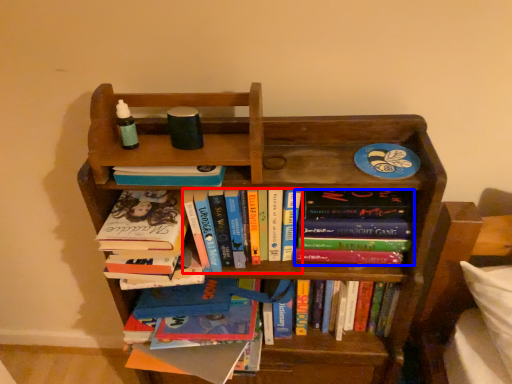
Question: Which point is closer to the camera, book (highlighted by a red box) or book (highlighted by a blue box)?

Choices:
 (A) book
 (B) book

Answer: (A)